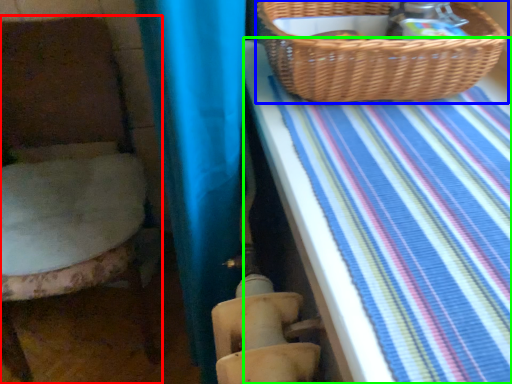
Question: Considering the real-world distances, which object is farthest from furniture (highlighted by a red box)? picnic basket (highlighted by a blue box) or sheet (highlighted by a green box)?

Choices:
 (A) picnic basket
 (B) sheet

Answer: (A)